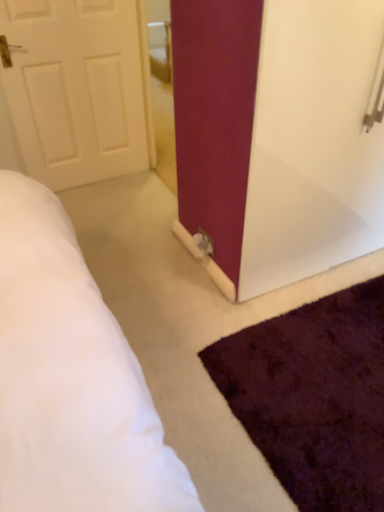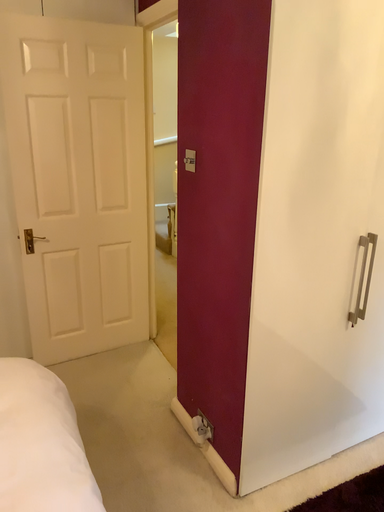
Question: Which way did the camera rotate in the video?

Choices:
 (A) rotated downward
 (B) rotated upward

Answer: (B)